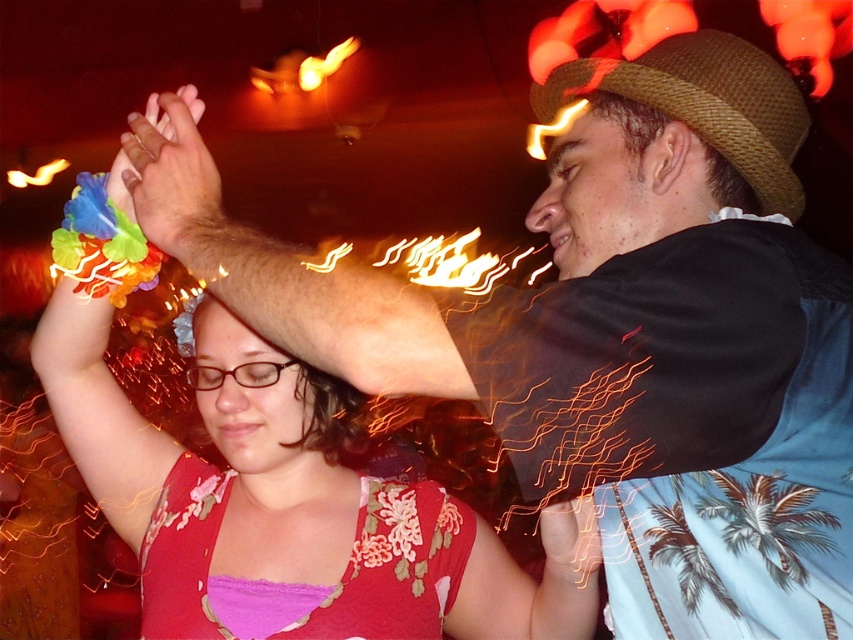
You are a photographer at the event and want to capture both the embroidered silk dress at center and the matte floral bracelet at upper left in a single frame. Which object should you focus on first to ensure both are in the shot?

The embroidered silk dress at center is not as tall as the matte floral bracelet at upper left, so you should focus on the taller matte floral bracelet at upper left first to ensure both are in the frame.

You are at a festival and see two people dancing. One is wearing a red floral top with a pink inner layer and has flower decorations in their hair. The other is in a black shirt with orange flame patterns and a light blue sarong with palm trees. There is also an embroidered silk dress at center represented by point (305, 584). Which person is closer to the embroidered silk dress at center?

The embroidered silk dress at center is represented by point (305, 584). Since the person on the right is wearing a light blue sarong with palm tree designs and the dress is at the center, the person on the right is closer to the embroidered silk dress at center.